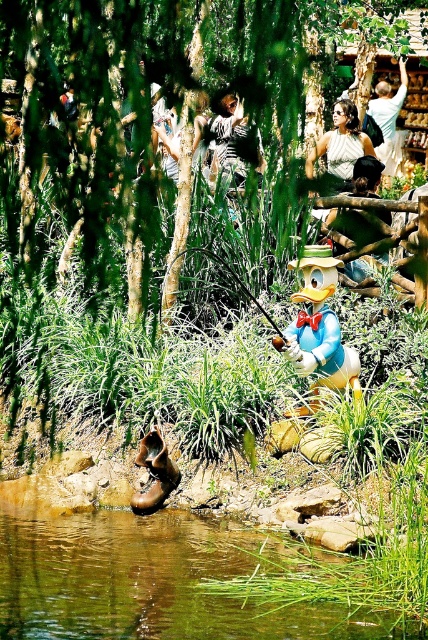
Question: Among these points, which one is farthest from the camera?

Choices:
 (A) (127, 525)
 (B) (246, 129)
 (C) (347, 224)
 (D) (189, 92)

Answer: (B)

Question: Does green grassy river at lower center have a smaller size compared to striped fabric shirt at upper center?

Choices:
 (A) yes
 (B) no

Answer: (B)

Question: Can you confirm if green grassy river at lower center is smaller than smooth brown hat at center?

Choices:
 (A) no
 (B) yes

Answer: (A)

Question: Which of these objects is positioned closest to the striped fabric shirt at upper center?

Choices:
 (A) matte yellow duck at center
 (B) green grassy river at lower center
 (C) smooth brown hat at center

Answer: (C)

Question: Is white cotton shirt at upper center bigger than striped fabric shirt at upper center?

Choices:
 (A) yes
 (B) no

Answer: (A)

Question: Which point is farther to the camera?

Choices:
 (A) (350, 380)
 (B) (178, 529)

Answer: (A)